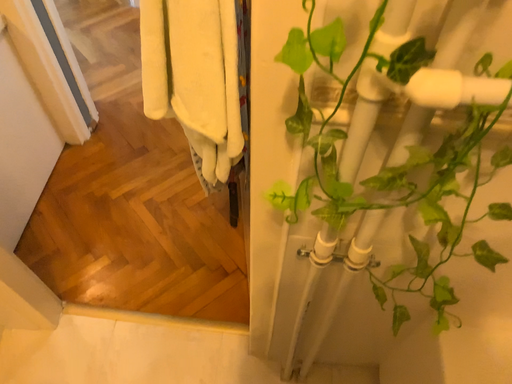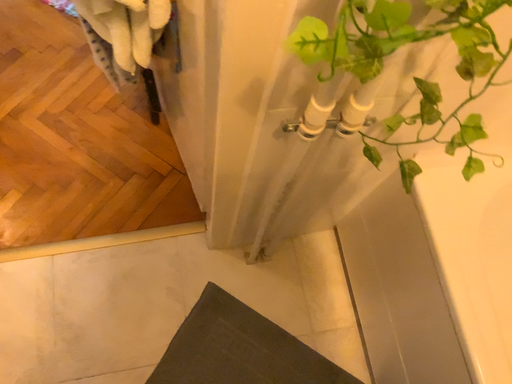
Question: Which way did the camera rotate in the video?

Choices:
 (A) rotated downward
 (B) rotated upward

Answer: (A)